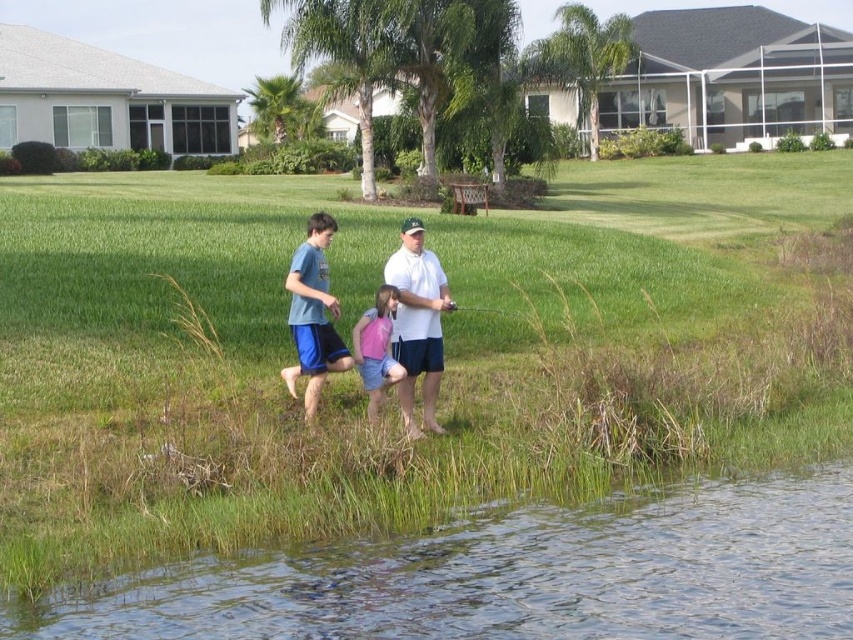
Question: Is blue cotton shorts at center closer to the viewer compared to pink fabric dress at center?

Choices:
 (A) no
 (B) yes

Answer: (A)

Question: Is blue cotton shorts at center positioned before pink fabric dress at center?

Choices:
 (A) yes
 (B) no

Answer: (B)

Question: Which object is the farthest from the green grass at center?

Choices:
 (A) white matte shirt at center
 (B) pink fabric dress at center

Answer: (A)

Question: Which object appears closest to the camera in this image?

Choices:
 (A) white matte shirt at center
 (B) green grass at center
 (C) clear water at lower left
 (D) pink fabric dress at center

Answer: (C)

Question: Which object is the closest to the blue cotton shorts at center?

Choices:
 (A) pink fabric dress at center
 (B) green grass at center

Answer: (A)

Question: In this image, where is white matte shirt at center located relative to pink fabric dress at center?

Choices:
 (A) above
 (B) below

Answer: (A)